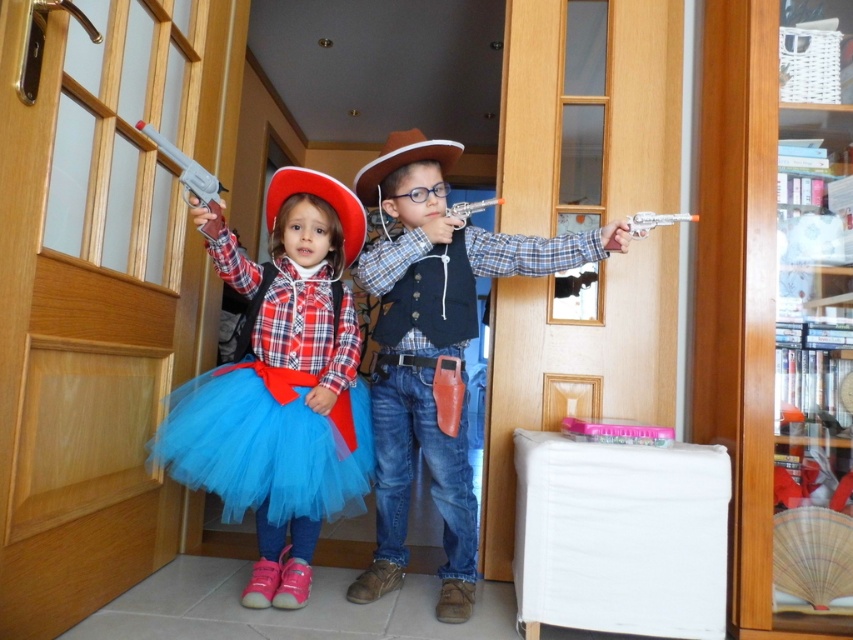
Which is more to the left, matte black vest at center or blue tulle ballet skirt at center?

From the viewer's perspective, blue tulle ballet skirt at center appears more on the left side.

Is matte black vest at center further to camera compared to blue tulle ballet skirt at center?

That is True.

Between point (454, 484) and point (161, 422), which one is positioned in front?

Point (161, 422)

Identify the location of matte black vest at center. (434, 348).

Is point (303, 593) positioned in front of point (202, 170)?

That is False.

Is matte red hat at upper left wider than matte plastic handgun at upper left?

Correct, the width of matte red hat at upper left exceeds that of matte plastic handgun at upper left.

Which is in front, point (264, 362) or point (187, 180)?

Point (187, 180) is in front.

Where is `matte red hat at upper left`? matte red hat at upper left is located at coordinates (281, 387).

Which is behind, point (219, 221) or point (349, 413)?

Point (349, 413)

Is point (225, 461) more distant than point (310, 474)?

No, it is in front of (310, 474).

Does point (315, 192) lie in front of point (231, 518)?

No, (315, 192) is behind (231, 518).

Where is `matte red hat at upper left`? matte red hat at upper left is located at coordinates (281, 387).